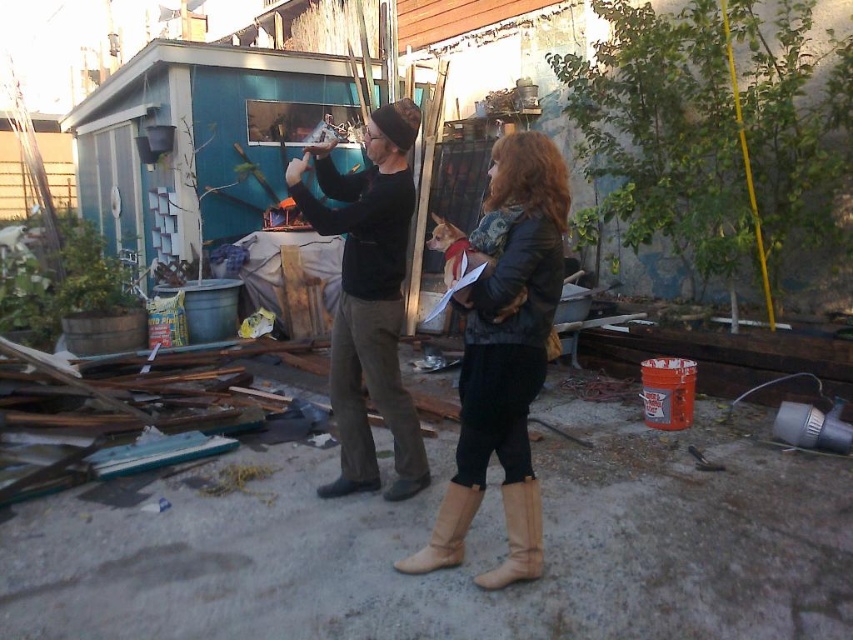
Question: Which of these objects is positioned farthest from the black matte pants at center?

Choices:
 (A) tan suede boot at lower center
 (B) tan suede boots at center
 (C) leather boots at center

Answer: (A)

Question: In this image, where is leather boots at center located relative to tan suede boots at center?

Choices:
 (A) below
 (B) above

Answer: (B)

Question: Can you confirm if black matte pants at center is positioned to the right of tan suede boots at center?

Choices:
 (A) no
 (B) yes

Answer: (A)

Question: Which of these objects is positioned closest to the black matte pants at center?

Choices:
 (A) leather boots at center
 (B) tan suede boots at center
 (C) tan suede boot at lower center

Answer: (A)

Question: Where is black matte pants at center located in relation to tan suede boot at lower center in the image?

Choices:
 (A) left
 (B) right

Answer: (A)

Question: Which of these objects is positioned farthest from the tan suede boots at center?

Choices:
 (A) black matte pants at center
 (B) leather boots at center

Answer: (A)